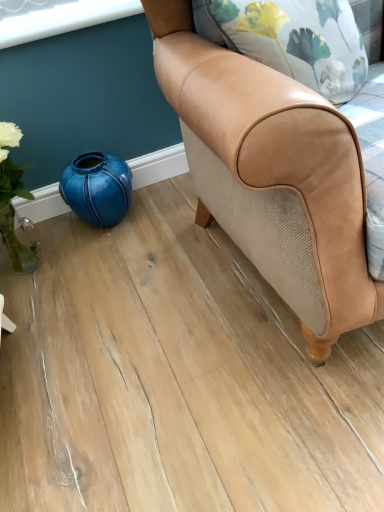
Question: Should I look upward or downward to see tan leather chair at center?

Choices:
 (A) up
 (B) down

Answer: (A)

Question: Is teal glossy vase at lower left aimed at tan leather chair at center?

Choices:
 (A) no
 (B) yes

Answer: (A)

Question: Is teal glossy vase at lower left bigger than tan leather chair at center?

Choices:
 (A) no
 (B) yes

Answer: (A)

Question: From a real-world perspective, is teal glossy vase at lower left positioned under tan leather chair at center based on gravity?

Choices:
 (A) no
 (B) yes

Answer: (B)

Question: Is teal glossy vase at lower left further to the viewer compared to tan leather chair at center?

Choices:
 (A) no
 (B) yes

Answer: (B)

Question: Is teal glossy vase at lower left turned away from tan leather chair at center?

Choices:
 (A) yes
 (B) no

Answer: (B)

Question: Is teal glossy vase at lower left to the right of tan leather chair at center from the viewer's perspective?

Choices:
 (A) no
 (B) yes

Answer: (A)

Question: Does tan leather chair at center have a smaller size compared to teal glossy vase at lower left?

Choices:
 (A) yes
 (B) no

Answer: (B)

Question: Is teal glossy vase at lower left surrounded by tan leather chair at center?

Choices:
 (A) yes
 (B) no

Answer: (B)

Question: Is tan leather chair at center bigger than teal glossy vase at lower left?

Choices:
 (A) no
 (B) yes

Answer: (B)

Question: Is the position of tan leather chair at center more distant than that of teal glossy vase at lower left?

Choices:
 (A) no
 (B) yes

Answer: (A)

Question: Is tan leather chair at center positioned beyond the bounds of teal glossy vase at lower left?

Choices:
 (A) yes
 (B) no

Answer: (A)

Question: Does tan leather chair at center appear on the left side of teal glossy vase at lower left?

Choices:
 (A) no
 (B) yes

Answer: (A)

Question: Considering the positions of teal glossy vase at lower left and tan leather chair at center in the image, is teal glossy vase at lower left taller or shorter than tan leather chair at center?

Choices:
 (A) tall
 (B) short

Answer: (B)